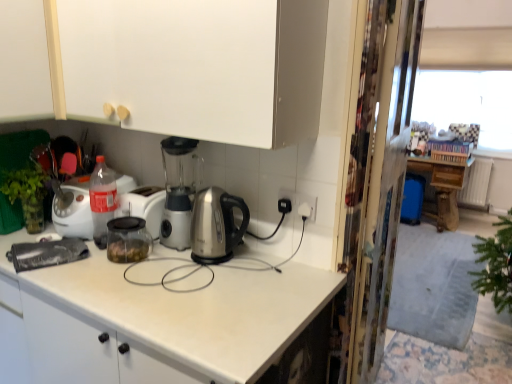
Where is `white matte cabinet at upper center, acting as the second cabinetry starting from the left`? white matte cabinet at upper center, acting as the second cabinetry starting from the left is located at coordinates (168, 66).

What do you see at coordinates (468, 105) in the screenshot? The height and width of the screenshot is (384, 512). I see `transparent plastic window screen at upper right` at bounding box center [468, 105].

Describe the element at coordinates (442, 187) in the screenshot. I see `wooden table at right` at that location.

The width and height of the screenshot is (512, 384). Find the location of `transparent plastic screen door at right`. transparent plastic screen door at right is located at coordinates (376, 180).

Which object is further away from the camera taking this photo, clear glass jar at center or white matte cabinet at upper left, arranged as the 2th cabinetry when viewed from the right?

clear glass jar at center is further from the camera.

Is there a large distance between clear glass jar at center and white matte cabinet at upper left, arranged as the first cabinetry when viewed from the left?

No, there isn't a large distance between clear glass jar at center and white matte cabinet at upper left, arranged as the first cabinetry when viewed from the left.

Between clear glass jar at center and white matte cabinet at upper left, arranged as the first cabinetry when viewed from the left, which one appears on the left side from the viewer's perspective?

white matte cabinet at upper left, arranged as the first cabinetry when viewed from the left, is more to the left.

Considering the sizes of objects clear glass jar at center and white matte cabinet at upper left, arranged as the first cabinetry when viewed from the left, in the image provided, who is thinner, clear glass jar at center or white matte cabinet at upper left, arranged as the first cabinetry when viewed from the left,?

clear glass jar at center is thinner.

Is transparent plastic screen door at right with clear glass jar at center?

transparent plastic screen door at right and clear glass jar at center are not in contact.

In the scene shown: Between transparent plastic screen door at right and clear glass jar at center, which one is positioned behind?

clear glass jar at center is more distant.

What are the coordinates of `home appliance located on the left of transparent plastic window screen at upper right` in the screenshot? It's located at (73, 209).

Considering the sizes of objects clear glass jar at center and transparent plastic window screen at upper right in the image provided, who is smaller, clear glass jar at center or transparent plastic window screen at upper right?

clear glass jar at center.

Is point (66, 198) closer to viewer compared to point (485, 127)?

Yes, it is.

Considering the relative sizes of clear glass jar at center and transparent plastic window screen at upper right in the image provided, is clear glass jar at center taller than transparent plastic window screen at upper right?

In fact, clear glass jar at center may be shorter than transparent plastic window screen at upper right.

Is transparent plastic screen door at right at the back of clear glass jar at center?

No, clear glass jar at center's orientation is not away from transparent plastic screen door at right.

Which object is positioned more to the left, clear glass jar at center or transparent plastic screen door at right?

clear glass jar at center.

In the scene shown: Is clear glass jar at center not within transparent plastic screen door at right?

clear glass jar at center lies outside transparent plastic screen door at right's area.

Between clear glass jar at center and transparent plastic screen door at right, which one has smaller width?

Answer: Thinner between the two is transparent plastic screen door at right.

Would you say white matte cabinet at upper center, acting as the second cabinetry starting from the left, is part of transparent plastic screen door at right's contents?

Actually, white matte cabinet at upper center, acting as the second cabinetry starting from the left, is outside transparent plastic screen door at right.

Looking at this image, can you confirm if transparent plastic screen door at right is smaller than white matte cabinet at upper center, arranged as the first cabinetry when viewed from the right?

Yes, transparent plastic screen door at right is smaller than white matte cabinet at upper center, arranged as the first cabinetry when viewed from the right.

How distant is transparent plastic screen door at right from white matte cabinet at upper center, acting as the second cabinetry starting from the left?

transparent plastic screen door at right is 69.69 centimeters from white matte cabinet at upper center, acting as the second cabinetry starting from the left.

Is point (380, 177) in front of point (65, 25)?

No, it is not.

In terms of width, does transparent plastic window screen at upper right look wider or thinner when compared to clear glass jar at center?

Considering their sizes, transparent plastic window screen at upper right looks slimmer than clear glass jar at center.

From the picture: From the image's perspective, is transparent plastic window screen at upper right beneath clear glass jar at center?

Actually, transparent plastic window screen at upper right appears above clear glass jar at center in the image.

In the scene shown: Based on their positions, is transparent plastic window screen at upper right located to the left or right of clear glass jar at center?

transparent plastic window screen at upper right is positioned on clear glass jar at center's right side.

Which is closer, (x=472, y=96) or (x=84, y=188)?

The point (x=84, y=188) is more forward.

Which object is wider, transparent plastic window screen at upper right or white matte cabinet at upper center, acting as the second cabinetry starting from the left?

Wider between the two is white matte cabinet at upper center, acting as the second cabinetry starting from the left.

Considering the relative sizes of transparent plastic window screen at upper right and white matte cabinet at upper center, arranged as the first cabinetry when viewed from the right, in the image provided, is transparent plastic window screen at upper right shorter than white matte cabinet at upper center, arranged as the first cabinetry when viewed from the right,?

No, transparent plastic window screen at upper right is not shorter than white matte cabinet at upper center, arranged as the first cabinetry when viewed from the right.

From a real-world perspective, is transparent plastic window screen at upper right below white matte cabinet at upper center, acting as the second cabinetry starting from the left?

Yes.

Between point (462, 75) and point (267, 118), which one is positioned behind?

The point (462, 75) is farther from the camera.

This screenshot has width=512, height=384. I want to click on home appliance below the white matte cabinet at upper left, arranged as the first cabinetry when viewed from the left (from a real-world perspective), so click(73, 209).

The height and width of the screenshot is (384, 512). What are the coordinates of `home appliance behind the transparent plastic screen door at right` in the screenshot? It's located at (73, 209).

From the image, which object appears to be nearer to white matte cabinet at upper left, arranged as the first cabinetry when viewed from the left, transparent plastic screen door at right or transparent plastic window screen at upper right?

transparent plastic screen door at right lies closer to white matte cabinet at upper left, arranged as the first cabinetry when viewed from the left, than the other object.

Estimate the real-world distances between objects in this image. Which object is further from transparent plastic screen door at right, transparent plastic window screen at upper right or clear glass jar at center?

transparent plastic window screen at upper right is further to transparent plastic screen door at right.

Looking at the image, which one is located closer to transparent plastic window screen at upper right, white matte cabinet at upper left, arranged as the 2th cabinetry when viewed from the right, or white matte cabinet at upper center, arranged as the first cabinetry when viewed from the right?

white matte cabinet at upper center, arranged as the first cabinetry when viewed from the right, is closer to transparent plastic window screen at upper right.

From the image, which object appears to be farther from wooden table at right, transparent plastic screen door at right or clear glass jar at center?

clear glass jar at center is positioned further to the anchor wooden table at right.

When comparing their distances from transparent plastic window screen at upper right, does wooden table at right or white matte cabinet at upper left, arranged as the 2th cabinetry when viewed from the right, seem further?

Among the two, white matte cabinet at upper left, arranged as the 2th cabinetry when viewed from the right, is located further to transparent plastic window screen at upper right.

From the image, which object appears to be farther from white matte cabinet at upper center, arranged as the first cabinetry when viewed from the right, transparent plastic window screen at upper right or white matte cabinet at upper left, arranged as the 2th cabinetry when viewed from the right?

The object further to white matte cabinet at upper center, arranged as the first cabinetry when viewed from the right, is transparent plastic window screen at upper right.

Estimate the real-world distances between objects in this image. Which object is further from transparent plastic screen door at right, wooden table at right or white matte cabinet at upper left, arranged as the 2th cabinetry when viewed from the right?

Among the two, wooden table at right is located further to transparent plastic screen door at right.

Which object lies nearer to the anchor point wooden table at right, transparent plastic window screen at upper right or white matte cabinet at upper center, arranged as the first cabinetry when viewed from the right?

Among the two, transparent plastic window screen at upper right is located nearer to wooden table at right.

This screenshot has height=384, width=512. I want to click on screen door between white matte cabinet at upper center, acting as the second cabinetry starting from the left, and transparent plastic window screen at upper right in the front-back direction, so click(x=376, y=180).

Identify the location of table between white matte cabinet at upper left, arranged as the 2th cabinetry when viewed from the right, and transparent plastic window screen at upper right from left to right. This screenshot has height=384, width=512. (442, 187).

This screenshot has width=512, height=384. I want to click on home appliance located between white matte cabinet at upper left, arranged as the first cabinetry when viewed from the left, and wooden table at right in the left-right direction, so click(x=73, y=209).

Find the location of a particular element. screen door between white matte cabinet at upper left, arranged as the 2th cabinetry when viewed from the right, and transparent plastic window screen at upper right, in the horizontal direction is located at coordinates (376, 180).